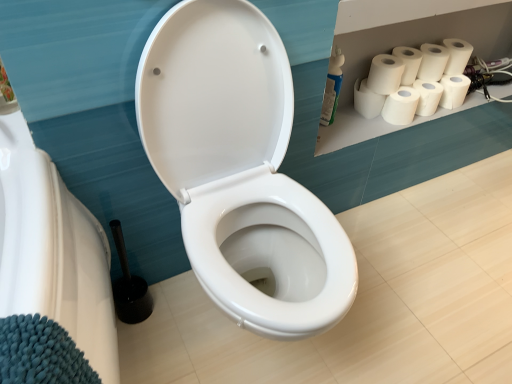
The image size is (512, 384). What do you see at coordinates (454, 90) in the screenshot?
I see `white matte toilet paper at upper right, placed as the 1th toilet paper when sorted from bottom to top` at bounding box center [454, 90].

Find the location of a particular element. The height and width of the screenshot is (384, 512). white matte toilet paper at upper right, acting as the second toilet paper starting from the top is located at coordinates (454, 90).

Describe the element at coordinates (408, 63) in the screenshot. I see `white matte paper towel at upper right, which is the fourth paper towel in left-to-right order` at that location.

Locate an element on the screen. white matte paper towel at upper right, the third paper towel viewed from the right is located at coordinates (408, 63).

What is the approximate height of white matte paper towel at upper right, marked as the fifth paper towel in a right-to-left arrangement?

It is 3.90 inches.

What is the approximate width of white matte paper towel at upper right, which is the fourth paper towel from right to left?

white matte paper towel at upper right, which is the fourth paper towel from right to left, is 3.41 inches wide.

This screenshot has height=384, width=512. What are the coordinates of `white matte toilet paper rolls at upper right` in the screenshot? It's located at (407, 45).

Considering the positions of points (444, 70) and (379, 111), is point (444, 70) farther from camera compared to point (379, 111)?

Yes, it is behind point (379, 111).

Are white matte toilet paper at upper right, marked as the second toilet paper in a bottom-to-top arrangement, and white matte paper towel at upper right, acting as the first paper towel starting from the left, located far from each other?

No.

Is white matte toilet paper at upper right, the first toilet paper when ordered from top to bottom, looking in the opposite direction of white matte paper towel at upper right, which appears as the sixth paper towel when viewed from the right?

No, white matte toilet paper at upper right, the first toilet paper when ordered from top to bottom, is not facing away from white matte paper towel at upper right, which appears as the sixth paper towel when viewed from the right.

From the image's perspective, is white matte paper towel at upper right, which is the sixth paper towel in left-to-right order, above white matte paper towel at upper right, placed as the fifth paper towel when sorted from left to right?

Yes, from the image's perspective, white matte paper towel at upper right, which is the sixth paper towel in left-to-right order, is above white matte paper towel at upper right, placed as the fifth paper towel when sorted from left to right.

From a real-world perspective, is white matte paper towel at upper right, arranged as the first paper towel when viewed from the right, on white matte paper towel at upper right, the second paper towel from the right?

Yes, from a real-world perspective, white matte paper towel at upper right, arranged as the first paper towel when viewed from the right, is over white matte paper towel at upper right, the second paper towel from the right

From a real-world perspective, count 4th paper towels upward from the white matte paper towel at upper right, the second paper towel from the right, and point to it. Please provide its 2D coordinates.

[(432, 62)]

Which is in front, point (426, 55) or point (430, 88)?

The point (430, 88) is in front.

Considering the relative sizes of white matte paper towel at upper right, which is the fourth paper towel from right to left, and white matte paper towel at upper right, the second paper towel from the right, in the image provided, is white matte paper towel at upper right, which is the fourth paper towel from right to left, thinner than white matte paper towel at upper right, the second paper towel from the right,?

Yes, white matte paper towel at upper right, which is the fourth paper towel from right to left, is thinner than white matte paper towel at upper right, the second paper towel from the right.

From the image's perspective, between white matte paper towel at upper right, which is the fourth paper towel from right to left, and white matte paper towel at upper right, placed as the fifth paper towel when sorted from left to right, which one is located above?

white matte paper towel at upper right, placed as the fifth paper towel when sorted from left to right, is shown above in the image.

Between white matte paper towel at upper right, which is the fourth paper towel from right to left, and white matte paper towel at upper right, the second paper towel from the right, which one has larger size?

With larger size is white matte paper towel at upper right, the second paper towel from the right.

Considering the sizes of objects white matte paper towel at upper right, the third paper towel viewed from the left, and white matte paper towel at upper right, placed as the fifth paper towel when sorted from left to right, in the image provided, who is taller, white matte paper towel at upper right, the third paper towel viewed from the left, or white matte paper towel at upper right, placed as the fifth paper towel when sorted from left to right,?

With more height is white matte paper towel at upper right, the third paper towel viewed from the left.

Is white matte paper towel at upper right, the third paper towel viewed from the right, oriented away from white matte toilet paper at upper right, placed as the 1th toilet paper when sorted from bottom to top?

No, white matte paper towel at upper right, the third paper towel viewed from the right,'s orientation is not away from white matte toilet paper at upper right, placed as the 1th toilet paper when sorted from bottom to top.

From the white matte paper towel at upper right, which is the fourth paper towel in left-to-right order, count 2nd toilet papers backward and point to it. Please provide its 2D coordinates.

[(454, 90)]

Which is more to the right, white matte paper towel at upper right, which is the fourth paper towel in left-to-right order, or white matte toilet paper at upper right, acting as the second toilet paper starting from the top?

From the viewer's perspective, white matte toilet paper at upper right, acting as the second toilet paper starting from the top, appears more on the right side.

From the image's perspective, is white matte toilet paper rolls at upper right below white matte paper towel at upper right, which is the sixth paper towel in left-to-right order?

Yes.

Considering the positions of objects white matte toilet paper rolls at upper right and white matte paper towel at upper right, arranged as the first paper towel when viewed from the right, in the image provided, who is behind, white matte toilet paper rolls at upper right or white matte paper towel at upper right, arranged as the first paper towel when viewed from the right,?

white matte paper towel at upper right, arranged as the first paper towel when viewed from the right, is more distant.

Which of these two, white matte toilet paper rolls at upper right or white matte paper towel at upper right, which is the sixth paper towel in left-to-right order, is smaller?

white matte paper towel at upper right, which is the sixth paper towel in left-to-right order.

Consider the image. Can you confirm if white matte toilet paper rolls at upper right is taller than white matte paper towel at upper right, which is the sixth paper towel in left-to-right order?

In fact, white matte toilet paper rolls at upper right may be shorter than white matte paper towel at upper right, which is the sixth paper towel in left-to-right order.

From a real-world perspective, which is physically above, white glossy toilet at center or white matte toilet paper at upper right, the first toilet paper when ordered from top to bottom?

white matte toilet paper at upper right, the first toilet paper when ordered from top to bottom, from a real-world perspective.

The width and height of the screenshot is (512, 384). Identify the location of toilet on the left of white matte toilet paper at upper right, the first toilet paper when ordered from top to bottom. (240, 169).

Which of these two, white glossy toilet at center or white matte toilet paper at upper right, marked as the second toilet paper in a bottom-to-top arrangement, stands shorter?

white matte toilet paper at upper right, marked as the second toilet paper in a bottom-to-top arrangement.

Considering the relative sizes of white matte paper towel at upper right, which is the sixth paper towel in left-to-right order, and white matte toilet paper at upper right, the first toilet paper when ordered from top to bottom, in the image provided, is white matte paper towel at upper right, which is the sixth paper towel in left-to-right order, bigger than white matte toilet paper at upper right, the first toilet paper when ordered from top to bottom,?

Indeed, white matte paper towel at upper right, which is the sixth paper towel in left-to-right order, has a larger size compared to white matte toilet paper at upper right, the first toilet paper when ordered from top to bottom.

From their relative heights in the image, would you say white matte paper towel at upper right, which is the sixth paper towel in left-to-right order, is taller or shorter than white matte toilet paper at upper right, marked as the second toilet paper in a bottom-to-top arrangement?

In the image, white matte paper towel at upper right, which is the sixth paper towel in left-to-right order, appears to be shorter than white matte toilet paper at upper right, marked as the second toilet paper in a bottom-to-top arrangement.

You are a GUI agent. You are given a task and a screenshot of the screen. Output one action in this format:
    pyautogui.click(x=<x>, y=<y>)
    Task: Click on the 1st toilet paper behind the white matte paper towel at upper right, acting as the first paper towel starting from the left, counting from the anchor's position
    This screenshot has width=512, height=384.
    Given the screenshot: What is the action you would take?
    pyautogui.click(x=457, y=55)

Where is `paper towel that is the 1st one when counting forward from the white matte paper towel at upper right, the second paper towel from the right`? This screenshot has height=384, width=512. paper towel that is the 1st one when counting forward from the white matte paper towel at upper right, the second paper towel from the right is located at coordinates (432, 62).

Estimate the real-world distances between objects in this image. Which object is further from white matte paper towel at upper right, placed as the fifth paper towel when sorted from left to right, white matte toilet paper at upper right, acting as the second toilet paper starting from the top, or white matte paper towel at upper right, which is the sixth paper towel in left-to-right order?

white matte paper towel at upper right, which is the sixth paper towel in left-to-right order, is positioned further to the anchor white matte paper towel at upper right, placed as the fifth paper towel when sorted from left to right.

When comparing their distances from white matte paper towel at upper right, placed as the fifth paper towel when sorted from left to right, does white matte paper towel at upper right, acting as the first paper towel starting from the left, or white matte toilet paper rolls at upper right seem further?

white matte toilet paper rolls at upper right.

When comparing their distances from white matte paper towel at upper right, arranged as the first paper towel when viewed from the right, does white matte paper towel at upper right, which ranks as the second paper towel in left-to-right order, or white matte paper towel at upper right, acting as the first paper towel starting from the left, seem further?

Based on the image, white matte paper towel at upper right, acting as the first paper towel starting from the left, appears to be further to white matte paper towel at upper right, arranged as the first paper towel when viewed from the right.

Looking at the image, which one is located closer to white matte paper towel at upper right, acting as the first paper towel starting from the left, white matte paper towel at upper right, which is the sixth paper towel in left-to-right order, or white matte toilet paper at upper right, acting as the second toilet paper starting from the top?

white matte paper towel at upper right, which is the sixth paper towel in left-to-right order, is positioned closer to the anchor white matte paper towel at upper right, acting as the first paper towel starting from the left.

Estimate the real-world distances between objects in this image. Which object is further from white glossy toilet at center, white matte toilet paper at upper right, the first toilet paper when ordered from top to bottom, or white matte paper towel at upper right, which ranks as the second paper towel in left-to-right order?

white matte toilet paper at upper right, the first toilet paper when ordered from top to bottom, is positioned further to the anchor white glossy toilet at center.

Looking at this image, when comparing their distances from white matte toilet paper at upper right, acting as the second toilet paper starting from the top, does white matte paper towel at upper right, placed as the fifth paper towel when sorted from left to right, or white matte paper towel at upper right, marked as the fifth paper towel in a right-to-left arrangement, seem closer?

white matte paper towel at upper right, placed as the fifth paper towel when sorted from left to right, is closer to white matte toilet paper at upper right, acting as the second toilet paper starting from the top.

When comparing their distances from white matte toilet paper at upper right, placed as the 1th toilet paper when sorted from bottom to top, does white matte toilet paper at upper right, the first toilet paper when ordered from top to bottom, or white glossy toilet at center seem closer?

white matte toilet paper at upper right, the first toilet paper when ordered from top to bottom, lies closer to white matte toilet paper at upper right, placed as the 1th toilet paper when sorted from bottom to top, than the other object.

Looking at the image, which one is located further to white matte paper towel at upper right, acting as the first paper towel starting from the left, white matte paper towel at upper right, the third paper towel viewed from the left, or white matte toilet paper at upper right, placed as the 1th toilet paper when sorted from bottom to top?

white matte toilet paper at upper right, placed as the 1th toilet paper when sorted from bottom to top, is further to white matte paper towel at upper right, acting as the first paper towel starting from the left.

This screenshot has height=384, width=512. Find the location of `shelf between white matte paper towel at upper right, the third paper towel viewed from the right, and white matte toilet paper at upper right, acting as the second toilet paper starting from the top, in the horizontal direction`. shelf between white matte paper towel at upper right, the third paper towel viewed from the right, and white matte toilet paper at upper right, acting as the second toilet paper starting from the top, in the horizontal direction is located at coordinates (407, 45).

Locate an element on the screen. This screenshot has height=384, width=512. shelf between white matte paper towel at upper right, which is the fourth paper towel from right to left, and white matte toilet paper at upper right, acting as the second toilet paper starting from the top, in the horizontal direction is located at coordinates click(407, 45).

The width and height of the screenshot is (512, 384). I want to click on shelf between white glossy toilet at center and white matte toilet paper at upper right, acting as the second toilet paper starting from the top, from front to back, so click(407, 45).

The image size is (512, 384). What are the coordinates of `shelf between white glossy toilet at center and white matte paper towel at upper right, which appears as the sixth paper towel when viewed from the right, along the z-axis` in the screenshot? It's located at (407, 45).